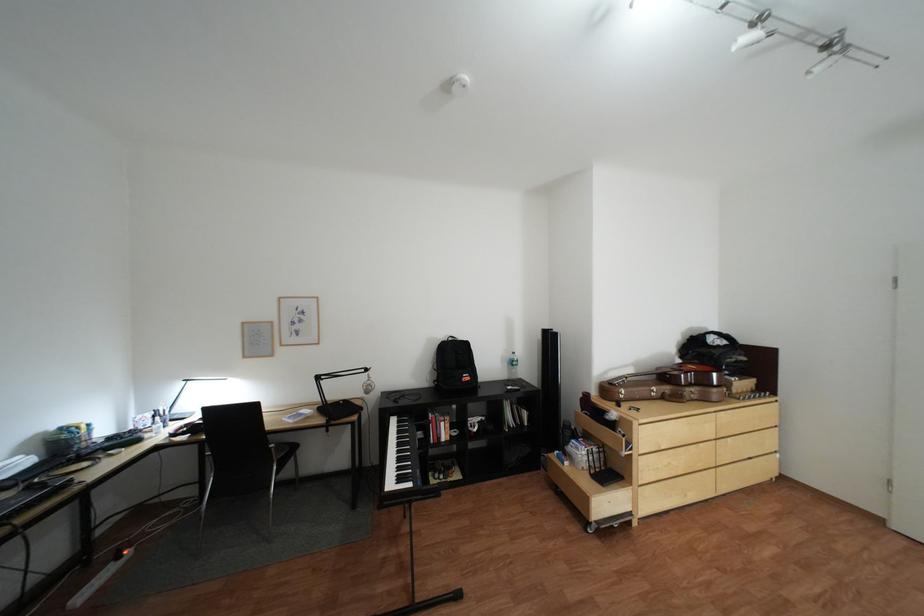
What do you see at coordinates (284, 453) in the screenshot? Image resolution: width=924 pixels, height=616 pixels. I see `the chair sitting surface` at bounding box center [284, 453].